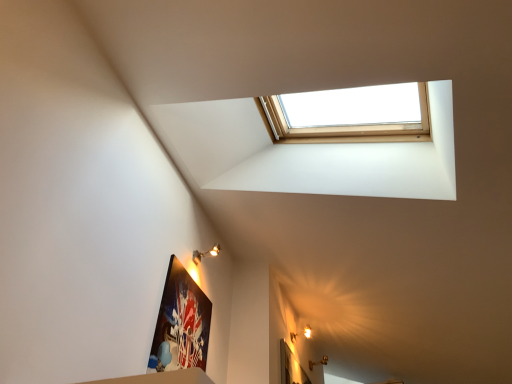
Question: In which direction should I rotate to look at matte gold light fixture at upper center, which ranks as the 2th light fixture in back-to-front order?

Choices:
 (A) left
 (B) right

Answer: (A)

Question: From a real-world perspective, is matte gold wall sconce at upper right, positioned as the first light fixture in bottom-to-top order, physically below matte black picture frame at lower left?

Choices:
 (A) no
 (B) yes

Answer: (A)

Question: From the image's perspective, would you say matte gold wall sconce at upper right, which is counted as the 2th light fixture, starting from the top, is shown under matte black picture frame at lower left?

Choices:
 (A) no
 (B) yes

Answer: (B)

Question: From a real-world perspective, does matte gold wall sconce at upper right, the 1th light fixture when ordered from right to left, stand above matte black picture frame at lower left?

Choices:
 (A) no
 (B) yes

Answer: (B)

Question: Is matte gold wall sconce at upper right, positioned as the first light fixture in bottom-to-top order, touching matte black picture frame at lower left?

Choices:
 (A) yes
 (B) no

Answer: (B)

Question: Can we say matte gold wall sconce at upper right, the 1th light fixture when ordered from right to left, lies outside matte black picture frame at lower left?

Choices:
 (A) no
 (B) yes

Answer: (B)

Question: Is matte gold wall sconce at upper right, the 1th light fixture when ordered from right to left, surrounding matte black picture frame at lower left?

Choices:
 (A) no
 (B) yes

Answer: (A)

Question: Are matte black picture frame at lower left and matte gold wall sconce at upper right, the 1th light fixture when ordered from right to left, beside each other?

Choices:
 (A) yes
 (B) no

Answer: (B)

Question: Is matte black picture frame at lower left wider than matte gold wall sconce at upper right, the 1th light fixture when ordered from right to left?

Choices:
 (A) yes
 (B) no

Answer: (B)

Question: Is matte black picture frame at lower left thinner than matte gold wall sconce at upper right, the 1th light fixture when ordered from right to left?

Choices:
 (A) yes
 (B) no

Answer: (A)

Question: Is matte black picture frame at lower left looking in the opposite direction of matte gold wall sconce at upper right, the 1th light fixture when ordered from right to left?

Choices:
 (A) yes
 (B) no

Answer: (B)

Question: Does matte black picture frame at lower left have a lesser height compared to matte gold wall sconce at upper right, which ranks as the second light fixture in front-to-back order?

Choices:
 (A) yes
 (B) no

Answer: (B)

Question: Would you say matte black picture frame at lower left is a long distance from matte gold wall sconce at upper right, the 1th light fixture when ordered from right to left?

Choices:
 (A) yes
 (B) no

Answer: (A)

Question: From a real-world perspective, is matte gold wall sconce at upper right, positioned as the first light fixture in bottom-to-top order, over matte gold light fixture at upper center, the second light fixture from the right?

Choices:
 (A) no
 (B) yes

Answer: (A)